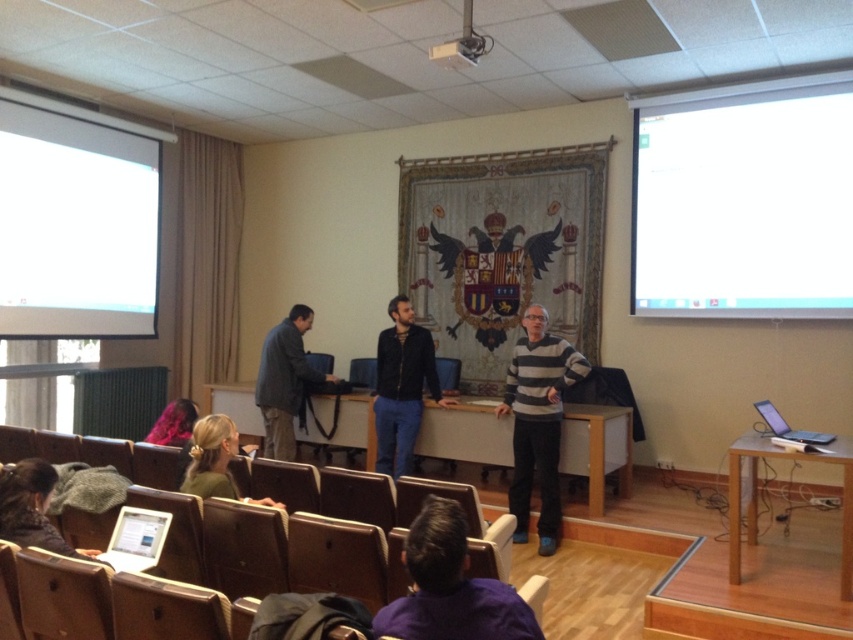
Question: Does white matte projection screen at upper left have a larger size compared to striped sweater at center?

Choices:
 (A) no
 (B) yes

Answer: (B)

Question: Is white glossy projection screen at upper right to the left of white matte projection screen at upper left from the viewer's perspective?

Choices:
 (A) yes
 (B) no

Answer: (B)

Question: Considering the relative positions of dark brown hair at lower left and matte plastic chair at center in the image provided, where is dark brown hair at lower left located with respect to matte plastic chair at center?

Choices:
 (A) above
 (B) below

Answer: (B)

Question: Which point appears farthest from the camera in this image?

Choices:
 (A) (103, 296)
 (B) (511, 616)
 (C) (187, 477)

Answer: (A)

Question: Which object is positioned farthest from the green matte sweater at lower left?

Choices:
 (A) purple fabric at lower center
 (B) metallic projector at upper center

Answer: (B)

Question: Which point is farther to the camera?

Choices:
 (A) white matte projection screen at upper left
 (B) dark gray fabric jacket at center
 (C) green matte sweater at lower left

Answer: (A)